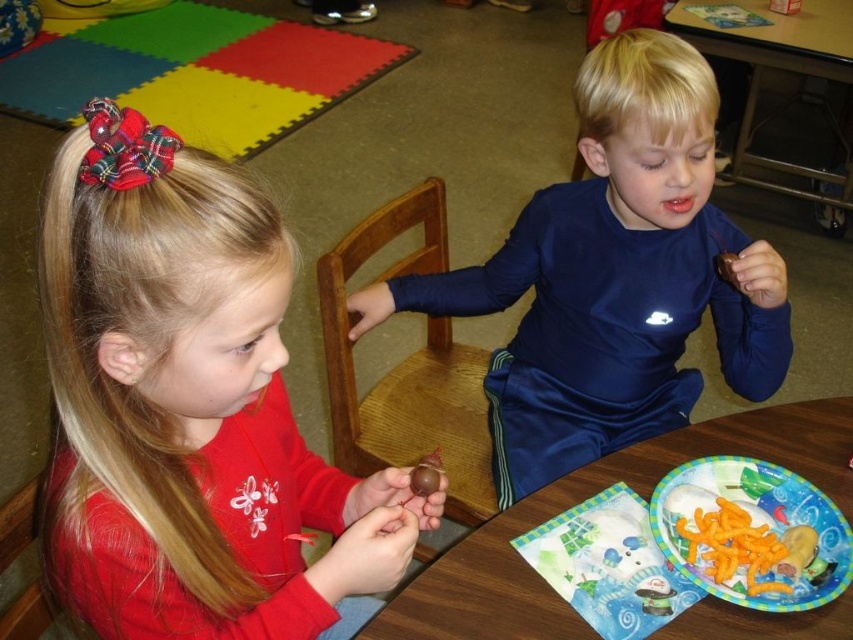
You are a teacher observing the classroom scene. You notice the matte red shirt at center and the paper plate at lower center on the table. Which object is taller?

The matte red shirt at center is taller than the paper plate at lower center.

You are a teacher observing two children in your classroom. You notice the matte red shirt at center and the shiny blue shirt at center. Which child is wearing a smaller sized shirt?

The matte red shirt at center has a smaller size compared to the shiny blue shirt at center, so the child wearing the matte red shirt at center has the smaller sized shirt.

You are a teacher observing the scene. You want to place a new snack on the table so that it is visible to both children. Where should you place the snack relative to the matte red shirt at center and the paper plate at lower center?

The matte red shirt at center is in front of the paper plate at lower center. To make the snack visible to both children, place it behind the matte red shirt at center so it is in front of the paper plate at lower center, ensuring both can see it.